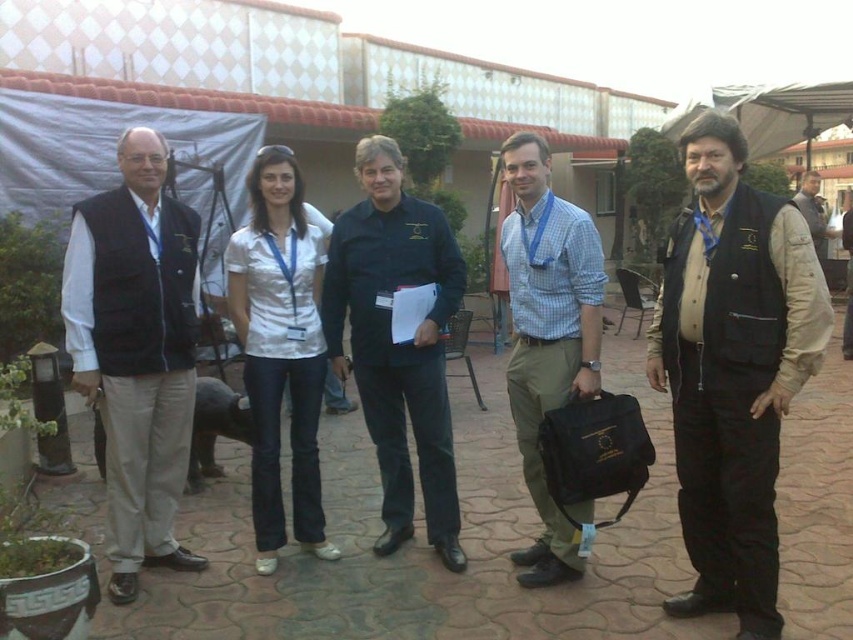
From the picture: You are a photographer adjusting the camera focus on the group. The camera has a focus point at position coordinates of 0.578, 0.859. Which object from the list below is at this focus point? Choose from the options below. A. matte black vest at center B. the folder C. the briefcase

The matte black vest at center is located at point [732,369], so the correct answer is A. matte black vest at center.